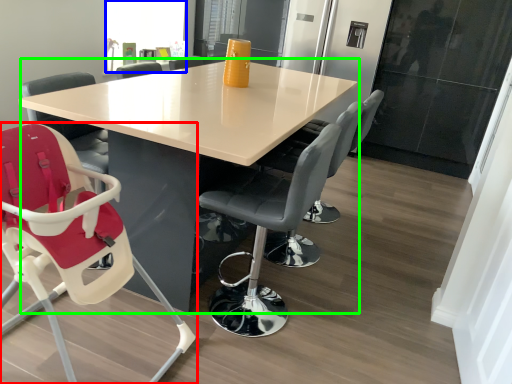
Question: Considering the real-world distances, which object is closest to chair (highlighted by a red box)? window screen (highlighted by a blue box) or table (highlighted by a green box).

Choices:
 (A) window screen
 (B) table

Answer: (B)